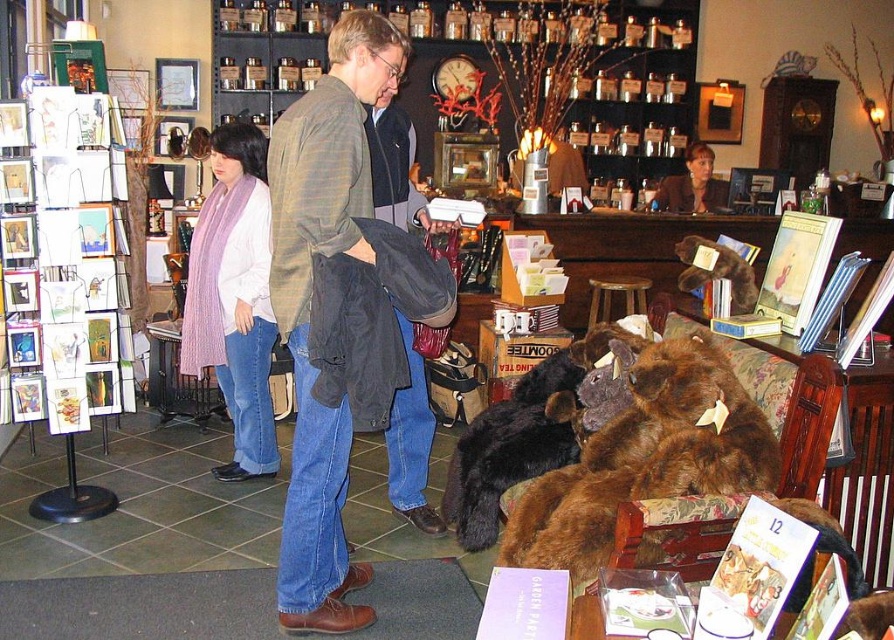
Question: Is green plaid shirt at center positioned before wooden stool at center?

Choices:
 (A) no
 (B) yes

Answer: (B)

Question: Estimate the real-world distances between objects in this image. Which object is closer to the green plaid shirt at center?

Choices:
 (A) wooden stool at center
 (B) purple striped scarf at left

Answer: (B)

Question: Is purple striped scarf at left positioned in front of wooden stool at center?

Choices:
 (A) no
 (B) yes

Answer: (B)

Question: Which object is farther from the camera taking this photo?

Choices:
 (A) green plaid shirt at center
 (B) wooden stool at center
 (C) purple striped scarf at left

Answer: (B)

Question: Among these points, which one is farthest from the camera?

Choices:
 (A) (399, 496)
 (B) (595, 291)

Answer: (B)

Question: Is green plaid shirt at center above purple striped scarf at left?

Choices:
 (A) yes
 (B) no

Answer: (B)